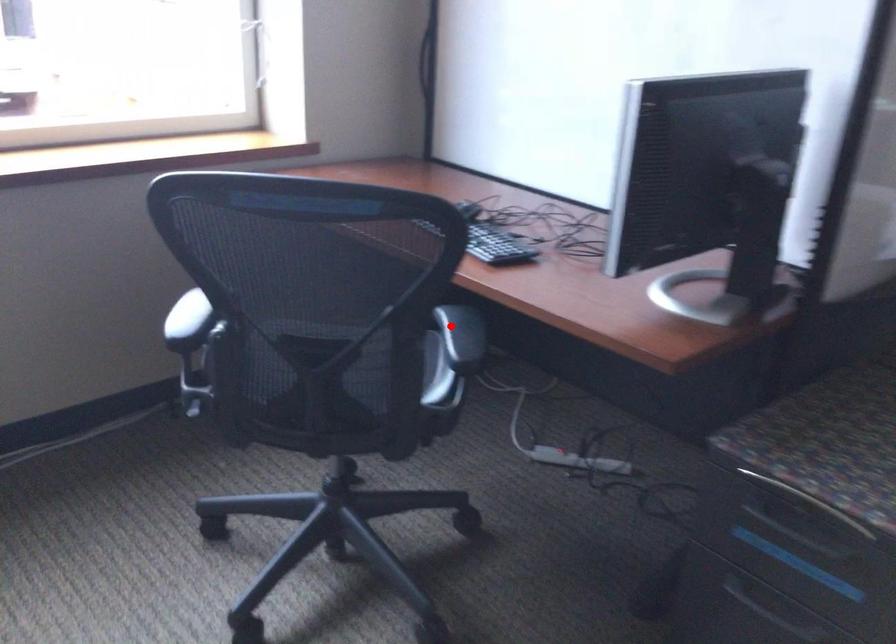
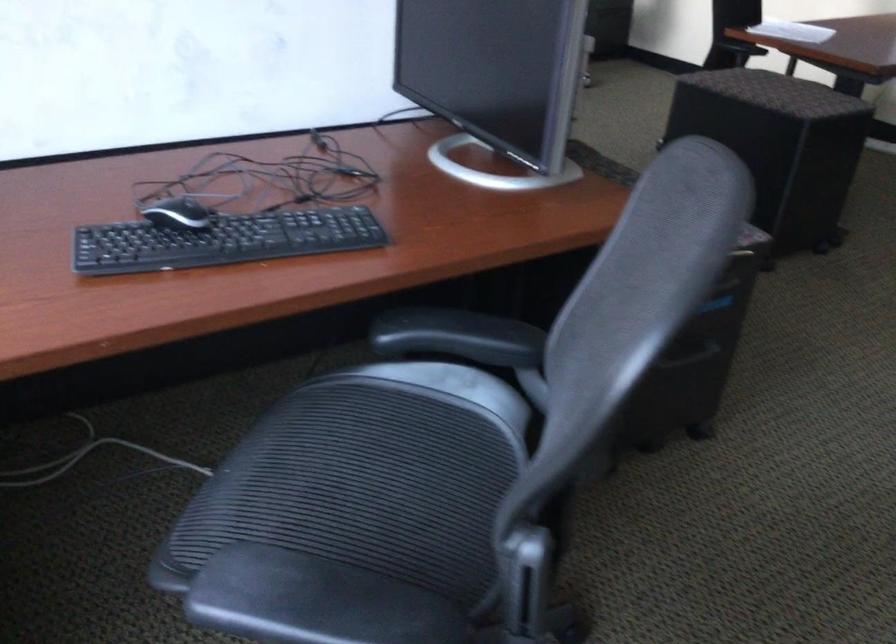
Question: I am providing you with two images of the same scene from different viewpoints. A red point is shown in image1. For the corresponding object point in image2, is it positioned nearer or farther from the camera?

Choices:
 (A) Nearer
 (B) Farther

Answer: (A)